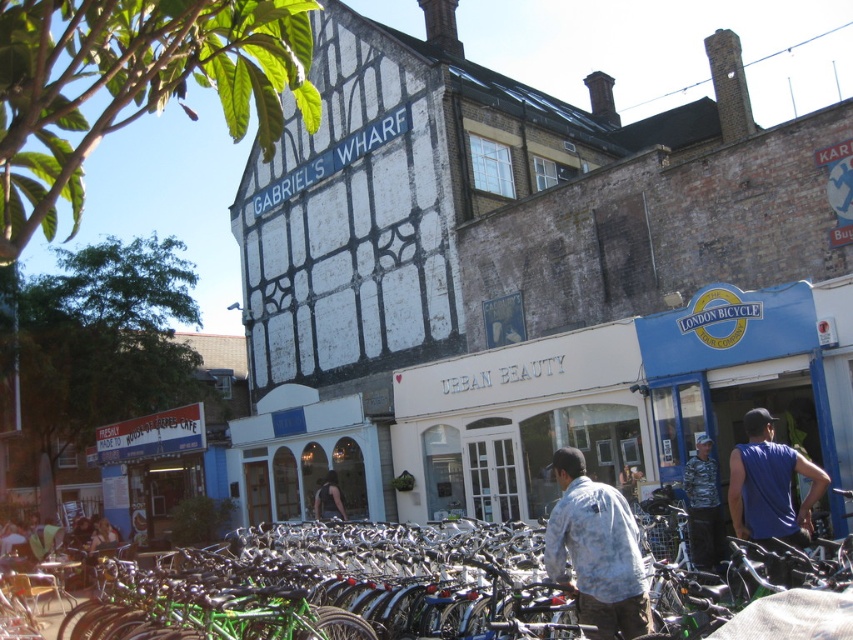
Question: Considering the real-world distances, which object is farthest from the light blue faded shirt at center?

Choices:
 (A) blue sleeveless shirt at center-right
 (B) white matte building at center
 (C) shiny metallic bicycle at center
 (D) dark blue shirt at center

Answer: (D)

Question: Is white matte building at center positioned at the back of blue sleeveless shirt at center-right?

Choices:
 (A) yes
 (B) no

Answer: (A)

Question: Is the position of white matte building at center more distant than that of dark blue shirt at center?

Choices:
 (A) yes
 (B) no

Answer: (B)

Question: Based on their relative distances, which object is farther from the white matte building at center?

Choices:
 (A) camouflage jacket at center
 (B) dark blue shirt at center
 (C) shiny metallic bicycle at center

Answer: (A)

Question: Which of the following is the farthest from the observer?

Choices:
 (A) (283, 492)
 (B) (706, 531)
 (C) (561, 477)

Answer: (A)

Question: Is shiny metallic bicycle at center smaller than dark blue shirt at center?

Choices:
 (A) no
 (B) yes

Answer: (A)